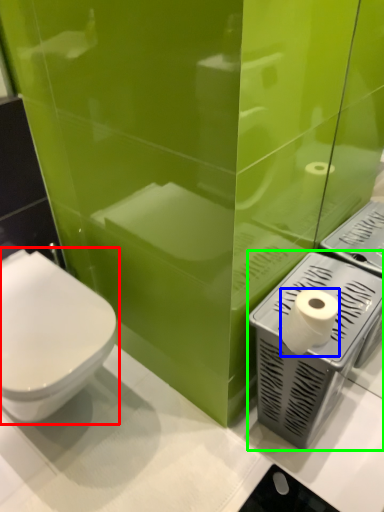
Question: Which object is positioned farthest from toilet (highlighted by a red box)? Select from toilet paper (highlighted by a blue box) and appliance (highlighted by a green box).

Choices:
 (A) toilet paper
 (B) appliance

Answer: (A)